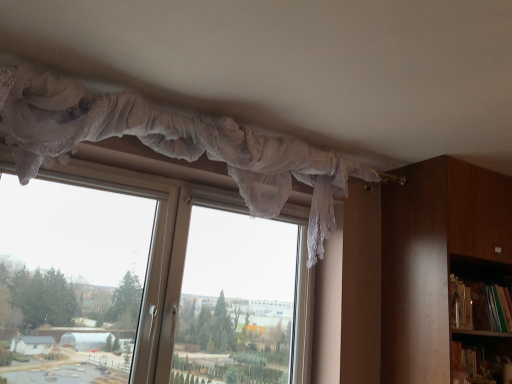
The image size is (512, 384). What do you see at coordinates (170, 144) in the screenshot? I see `white lace curtain at upper center` at bounding box center [170, 144].

At what (x,y) coordinates should I click in order to perform the action: click on green matte bookshelf at right. Please return your answer as a coordinate pair (x, y). Looking at the image, I should click on (480, 306).

What is the approximate width of green matte bookshelf at right?

green matte bookshelf at right is 5.43 inches wide.

At what (x,y) coordinates should I click in order to perform the action: click on transparent lace curtain at upper center. Please return your answer as a coordinate pair (x, y). Image resolution: width=512 pixels, height=384 pixels. Looking at the image, I should click on (153, 252).

Does white lace curtain at upper center have a greater height compared to brown wooden bookcase at right?

No, white lace curtain at upper center is not taller than brown wooden bookcase at right.

Is white lace curtain at upper center facing away from brown wooden bookcase at right?

No, white lace curtain at upper center is not facing away from brown wooden bookcase at right.

Is point (286, 200) closer to viewer compared to point (411, 272)?

Yes, point (286, 200) is in front of point (411, 272).

From a real-world perspective, is transparent lace curtain at upper center above or below green matte bookshelf at right?

Clearly, from a real-world perspective, transparent lace curtain at upper center is below green matte bookshelf at right.

Based on the photo, is transparent lace curtain at upper center facing towards green matte bookshelf at right?

No, transparent lace curtain at upper center does not turn towards green matte bookshelf at right.

Is transparent lace curtain at upper center taller or shorter than green matte bookshelf at right?

Clearly, transparent lace curtain at upper center is taller compared to green matte bookshelf at right.

Considering the sizes of white lace curtain at upper center and green matte bookshelf at right in the image, is white lace curtain at upper center taller or shorter than green matte bookshelf at right?

In the image, white lace curtain at upper center appears to be taller than green matte bookshelf at right.

Which is more to the left, white lace curtain at upper center or green matte bookshelf at right?

white lace curtain at upper center.

Can you tell me how much white lace curtain at upper center and green matte bookshelf at right differ in facing direction?

They differ by 2.56 degrees in their facing directions.

From the image's perspective, would you say white lace curtain at upper center is shown under green matte bookshelf at right?

No, from the image's perspective, white lace curtain at upper center is not beneath green matte bookshelf at right.

What's the angular difference between green matte bookshelf at right and white lace curtain at upper center's facing directions?

green matte bookshelf at right and white lace curtain at upper center are facing 2.56 degrees away from each other.

Considering the positions of objects green matte bookshelf at right and white lace curtain at upper center in the image provided, who is more to the left, green matte bookshelf at right or white lace curtain at upper center?

white lace curtain at upper center is more to the left.

Image resolution: width=512 pixels, height=384 pixels. In order to click on curtain on the left of the green matte bookshelf at right in this screenshot , I will do `click(170, 144)`.

From the image's perspective, is green matte bookshelf at right located beneath white lace curtain at upper center?

Indeed, from the image's perspective, green matte bookshelf at right is shown beneath white lace curtain at upper center.

The image size is (512, 384). I want to click on bookcase that appears behind the white lace curtain at upper center, so click(443, 271).

Is brown wooden bookcase at right positioned far away from white lace curtain at upper center?

No, brown wooden bookcase at right is in close proximity to white lace curtain at upper center.

Could white lace curtain at upper center be considered to be inside brown wooden bookcase at right?

No, brown wooden bookcase at right does not contain white lace curtain at upper center.

Who is shorter, green matte bookshelf at right or brown wooden bookcase at right?

Standing shorter between the two is green matte bookshelf at right.

Considering the sizes of objects green matte bookshelf at right and brown wooden bookcase at right in the image provided, who is thinner, green matte bookshelf at right or brown wooden bookcase at right?

green matte bookshelf at right.

Between point (467, 313) and point (407, 298), which one is positioned behind?

The point (467, 313) is behind.

Between green matte bookshelf at right and brown wooden bookcase at right, which one is positioned behind?

green matte bookshelf at right is behind.

Is transparent lace curtain at upper center bigger or smaller than white lace curtain at upper center?

In the image, transparent lace curtain at upper center appears to be larger than white lace curtain at upper center.

Can you confirm if transparent lace curtain at upper center is positioned to the right of white lace curtain at upper center?

No, transparent lace curtain at upper center is not to the right of white lace curtain at upper center.

From a real-world perspective, who is located higher, transparent lace curtain at upper center or white lace curtain at upper center?

white lace curtain at upper center is physically above.

How many degrees apart are the facing directions of transparent lace curtain at upper center and white lace curtain at upper center?

The angle between the facing direction of transparent lace curtain at upper center and the facing direction of white lace curtain at upper center is 1.01 degrees.

At what (x,y) coordinates should I click in order to perform the action: click on curtain on the left of brown wooden bookcase at right. Please return your answer as a coordinate pair (x, y). Looking at the image, I should click on [170, 144].

Find the location of a particular element. The image size is (512, 384). book below the transparent lace curtain at upper center (from the image's perspective) is located at coordinates pos(480,306).

From the image, which object appears to be nearer to transparent lace curtain at upper center, white lace curtain at upper center or green matte bookshelf at right?

white lace curtain at upper center.

Estimate the real-world distances between objects in this image. Which object is further from white lace curtain at upper center, transparent lace curtain at upper center or brown wooden bookcase at right?

Based on the image, brown wooden bookcase at right appears to be further to white lace curtain at upper center.

Consider the image. Based on their spatial positions, is brown wooden bookcase at right or transparent lace curtain at upper center further from green matte bookshelf at right?

transparent lace curtain at upper center is positioned further to the anchor green matte bookshelf at right.

Which object lies nearer to the anchor point green matte bookshelf at right, white lace curtain at upper center or brown wooden bookcase at right?

brown wooden bookcase at right is closer to green matte bookshelf at right.

Looking at this image, when comparing their distances from white lace curtain at upper center, does green matte bookshelf at right or transparent lace curtain at upper center seem further?

Among the two, green matte bookshelf at right is located further to white lace curtain at upper center.

Estimate the real-world distances between objects in this image. Which object is further from green matte bookshelf at right, transparent lace curtain at upper center or brown wooden bookcase at right?

Based on the image, transparent lace curtain at upper center appears to be further to green matte bookshelf at right.

Estimate the real-world distances between objects in this image. Which object is closer to green matte bookshelf at right, transparent lace curtain at upper center or white lace curtain at upper center?

Among the two, white lace curtain at upper center is located nearer to green matte bookshelf at right.

Based on their spatial positions, is green matte bookshelf at right or brown wooden bookcase at right further from transparent lace curtain at upper center?

green matte bookshelf at right.

Where is `curtain situated between transparent lace curtain at upper center and green matte bookshelf at right from left to right`? Image resolution: width=512 pixels, height=384 pixels. curtain situated between transparent lace curtain at upper center and green matte bookshelf at right from left to right is located at coordinates (170, 144).

Locate an element on the screen. curtain between transparent lace curtain at upper center and brown wooden bookcase at right from left to right is located at coordinates (170, 144).

In order to click on bookcase between transparent lace curtain at upper center and green matte bookshelf at right in this screenshot , I will do `click(443, 271)`.

At what (x,y) coordinates should I click in order to perform the action: click on bookcase between white lace curtain at upper center and green matte bookshelf at right in the horizontal direction. Please return your answer as a coordinate pair (x, y). This screenshot has width=512, height=384. Looking at the image, I should click on (443, 271).